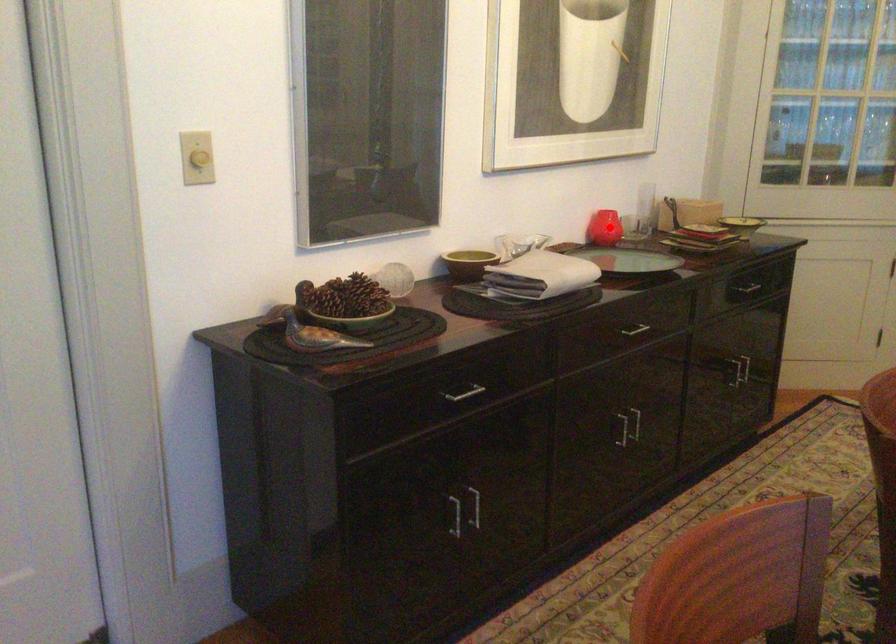
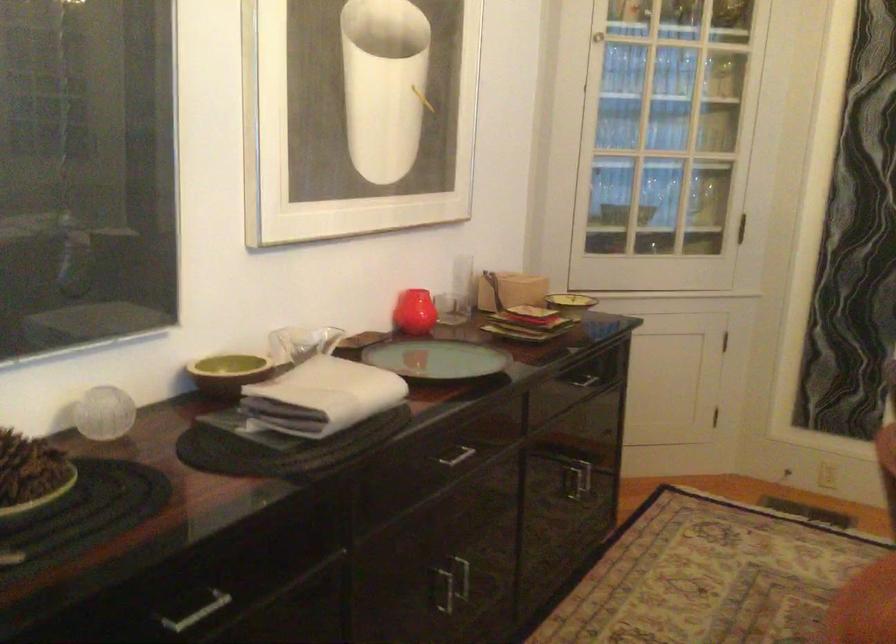
Question: I am providing you with two images of the same scene from different viewpoints. A red point is shown in image1. For the corresponding object point in image2, is it positioned nearer or farther from the camera?

Choices:
 (A) Nearer
 (B) Farther

Answer: (A)